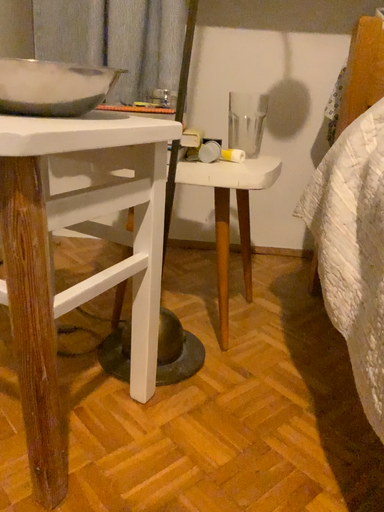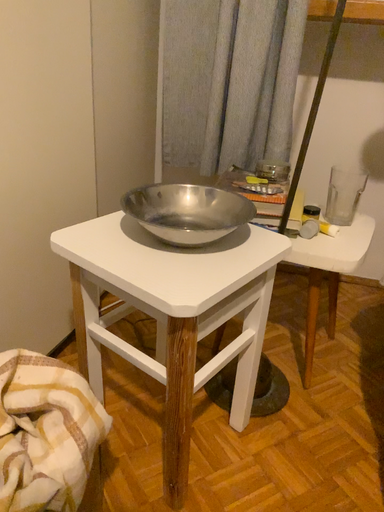
Question: How did the camera likely rotate when shooting the video?

Choices:
 (A) rotated right
 (B) rotated left

Answer: (B)